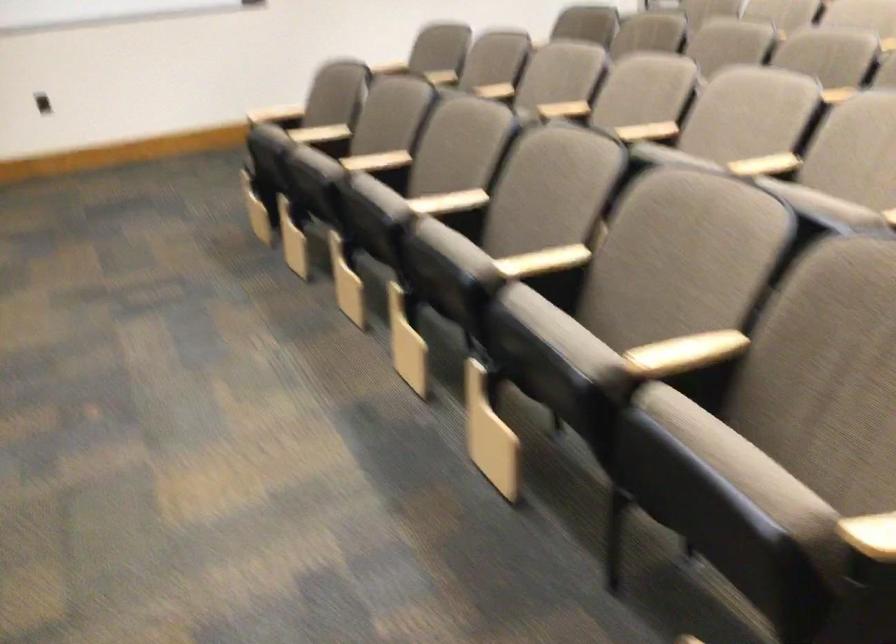
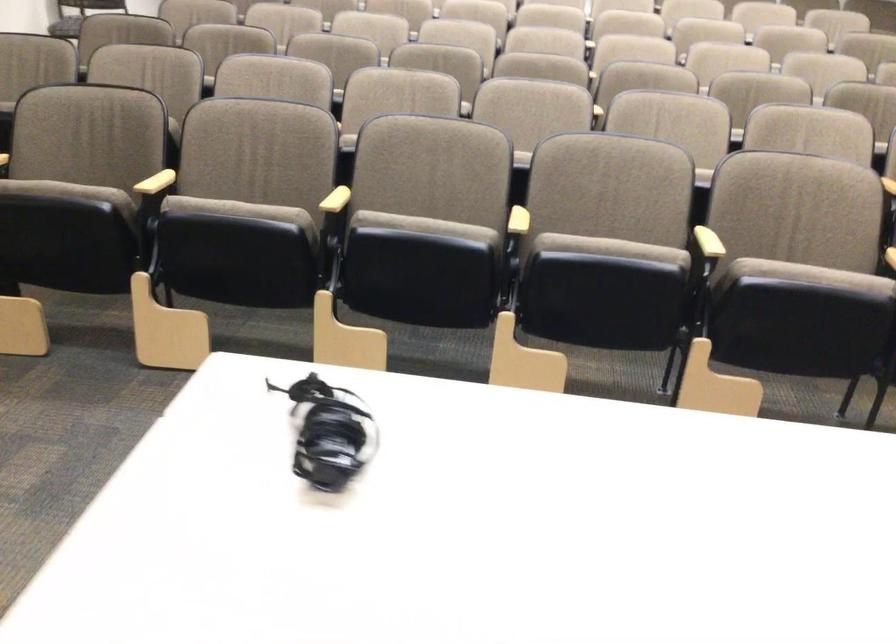
Find the pixel in the second image that matches pixel 444 241 in the first image.

(610, 249)